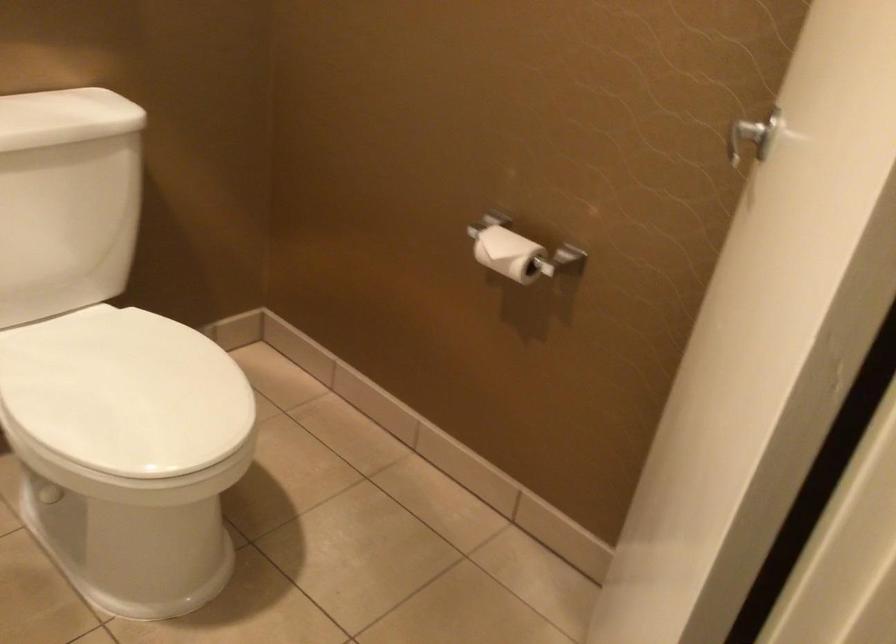
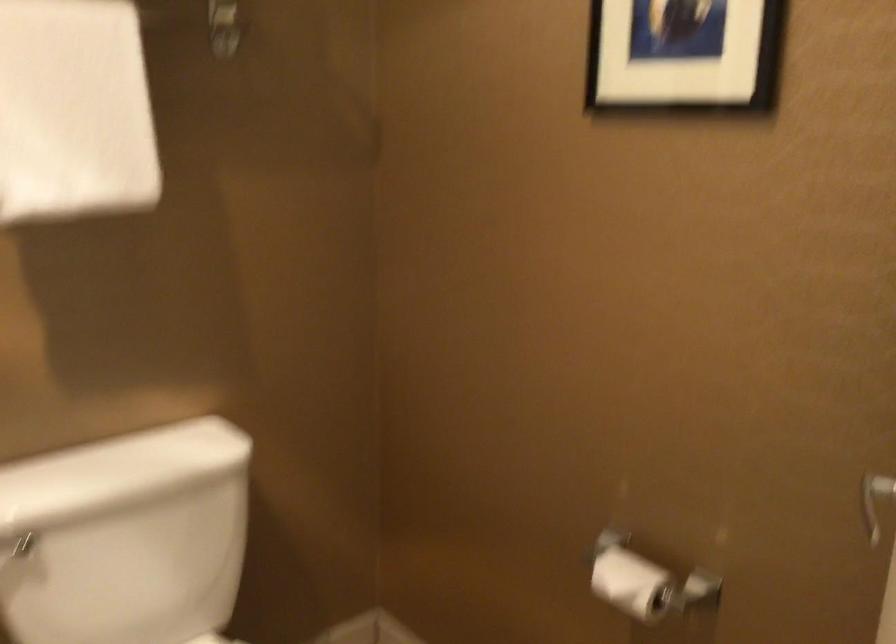
Question: Based on the continuous images, in which direction is the camera rotating? Reply with the corresponding letter.

Choices:
 (A) Left
 (B) Right
 (C) Up
 (D) Down

Answer: (C)